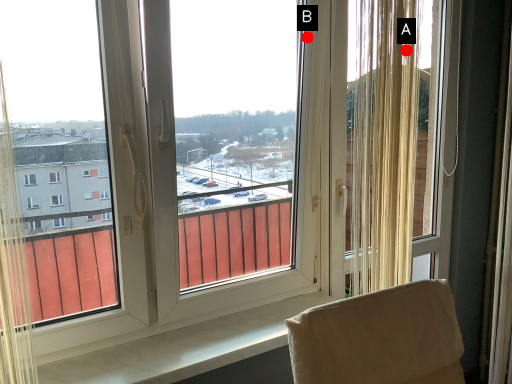
Question: Two points are circled on the image, labeled by A and B beside each circle. Which point appears closest to the camera in this image?

Choices:
 (A) A is closer
 (B) B is closer

Answer: (A)